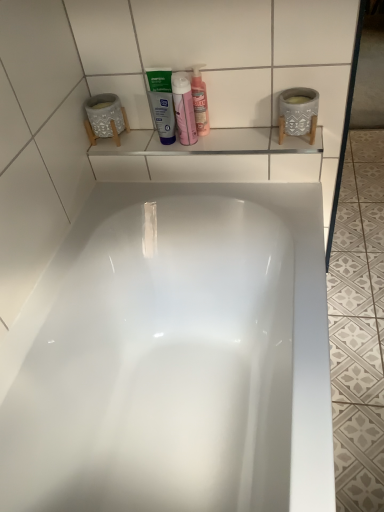
In order to click on vacant space situated on the left part of translucent plastic bottle at upper center in this screenshot , I will do `click(144, 143)`.